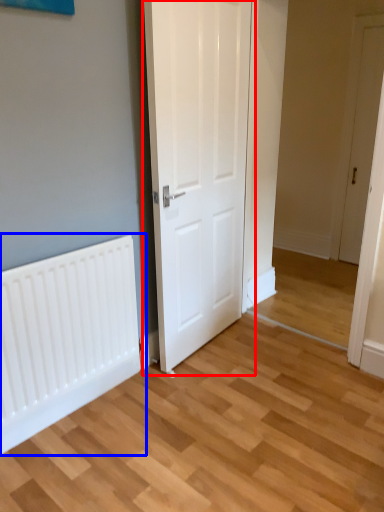
Question: Which object appears farthest to the camera in this image, door (highlighted by a red box) or radiator (highlighted by a blue box)?

Choices:
 (A) door
 (B) radiator

Answer: (B)